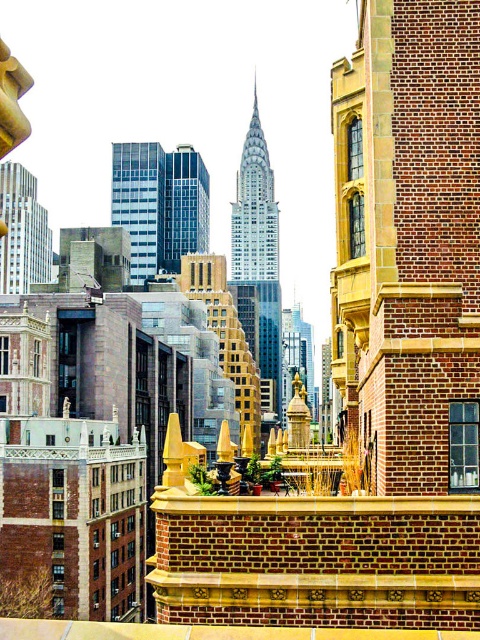
You are standing on a rooftop and want to take a photo of the shiny glass skyscraper at center. If your camera can focus on objects up to 250 meters away, will it be able to capture the skyscraper clearly?

The shiny glass skyscraper at center is 270.17 meters away from the camera. Since this distance exceeds the camera maximum focus range of 250 meters, the camera will not be able to focus on the skyscraper and capture it clearly.